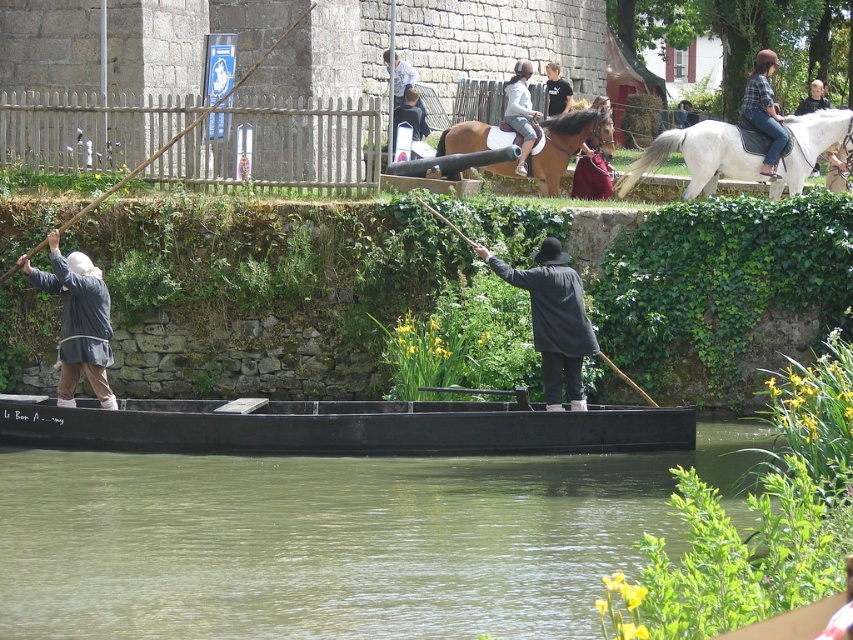
You are a spectator standing on the canal bank. You see the black matte coat at center and the wooden stick at left. Which object is taller?

The wooden stick at left is taller than the black matte coat at center.

You are an observer standing on the canal bank. You notice two people in the boat wearing the denim jacket at upper right and the black cotton shirt at upper center. Which clothing item is positioned lower on their bodies?

The denim jacket at upper right is positioned lower than the black cotton shirt at upper center because it is below it.

You are a tourist standing at the edge of the canal and want to take a photo of the black matte canoe at center. Based on its position, where should you aim your camera to capture it in the frame?

The black matte canoe at center is located at coordinates point (341, 428), so you should aim your camera slightly to the right and upper middle of the frame to capture it.